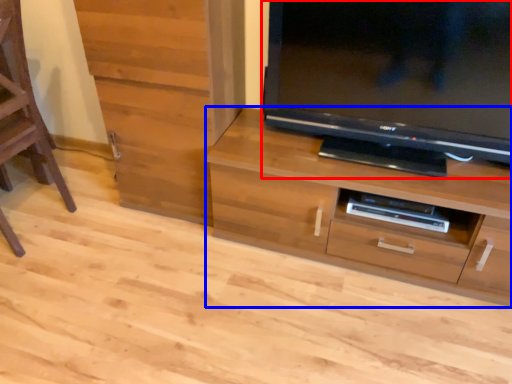
Question: Which object is further to the camera taking this photo, television (highlighted by a red box) or chest of drawers (highlighted by a blue box)?

Choices:
 (A) television
 (B) chest of drawers

Answer: (B)